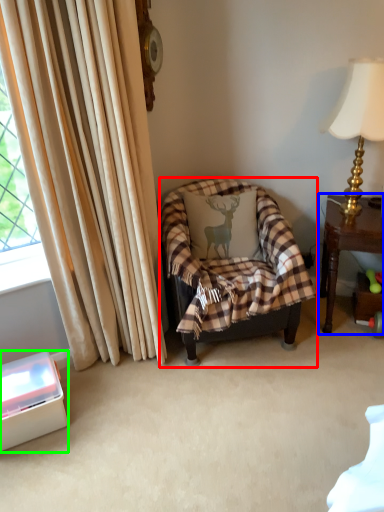
Question: Based on their relative distances, which object is nearer to chair (highlighted by a red box)? Choose from table (highlighted by a blue box) and box (highlighted by a green box).

Choices:
 (A) table
 (B) box

Answer: (A)